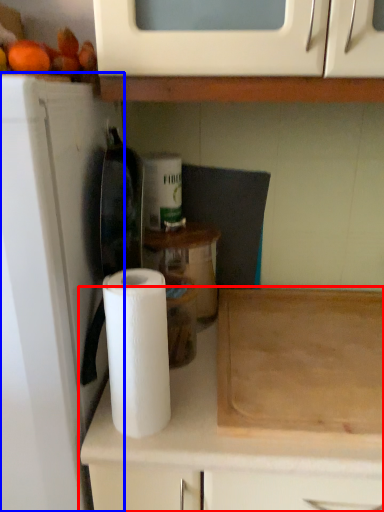
Question: Among these objects, which one is farthest to the camera, cabinetry (highlighted by a red box) or appliance (highlighted by a blue box)?

Choices:
 (A) cabinetry
 (B) appliance

Answer: (A)